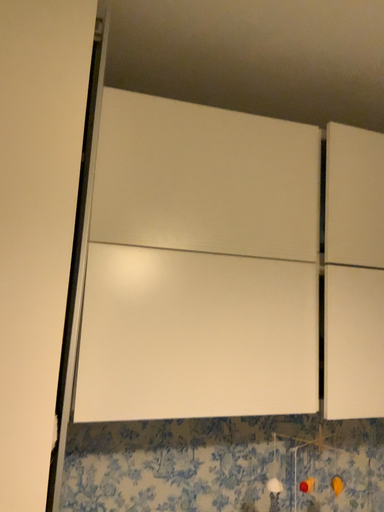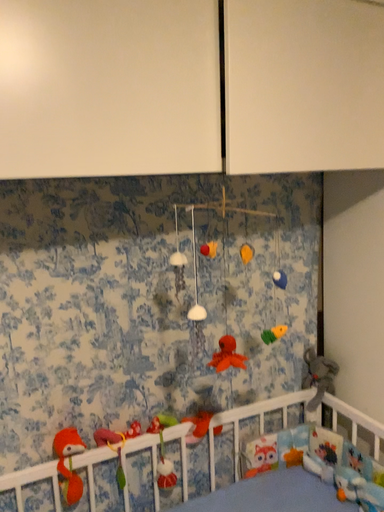
Question: Which way did the camera rotate in the video?

Choices:
 (A) rotated downward
 (B) rotated upward

Answer: (A)